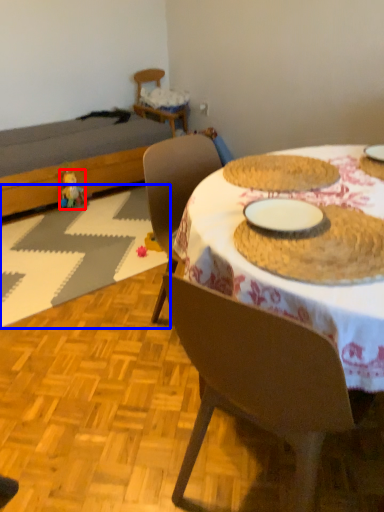
Question: Among these objects, which one is farthest to the camera, toy (highlighted by a red box) or place mat (highlighted by a blue box)?

Choices:
 (A) toy
 (B) place mat

Answer: (A)